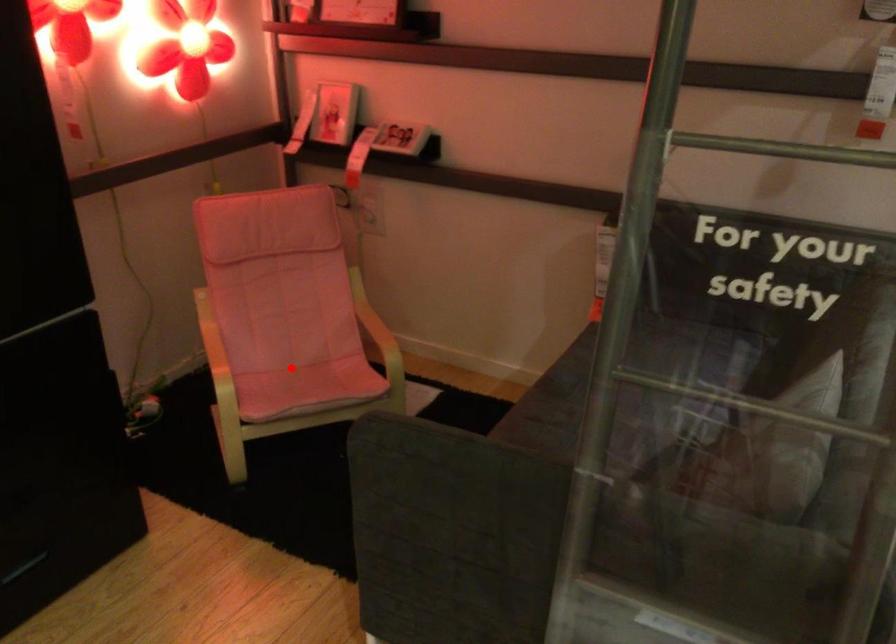
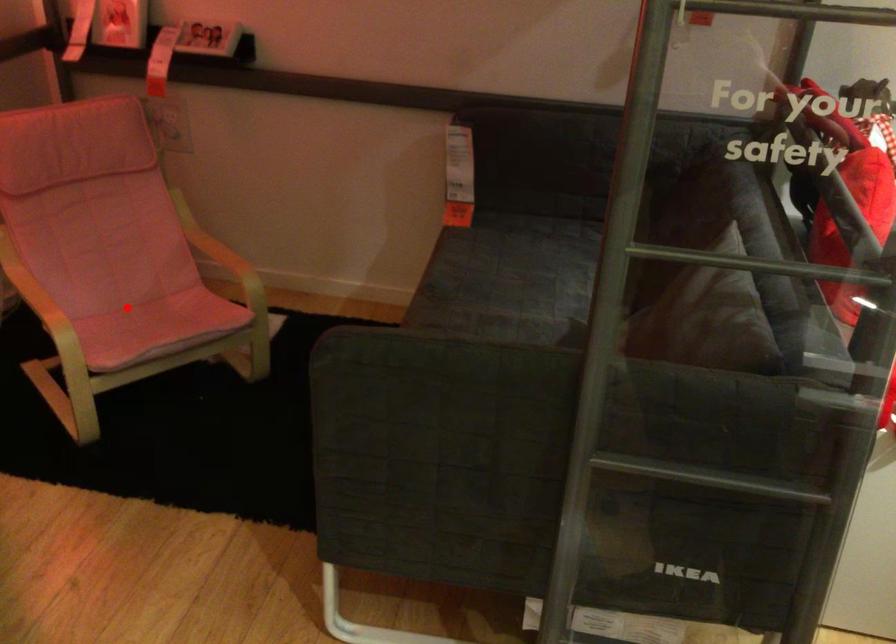
I am providing you with two images of the same scene from different viewpoints. A red point is marked on the first image and another point is marked on the second image. Is the red point in image1 aligned with the point shown in image2?

Yes